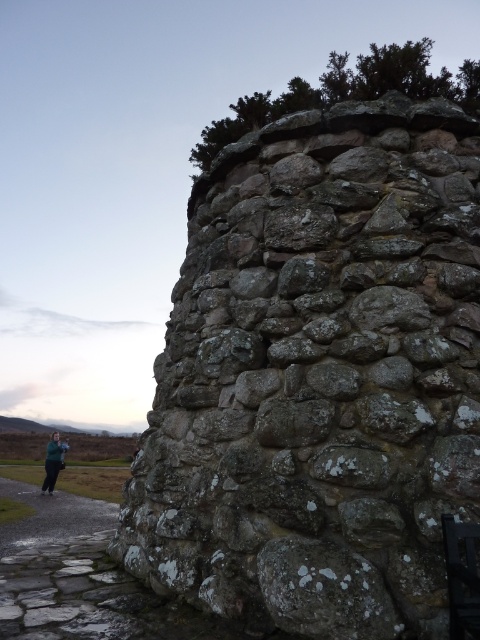
You are standing at the point marked as point (319, 376) in the image. What is the surface you are standing on?

The point (319, 376) is on lichen covered stone at center.